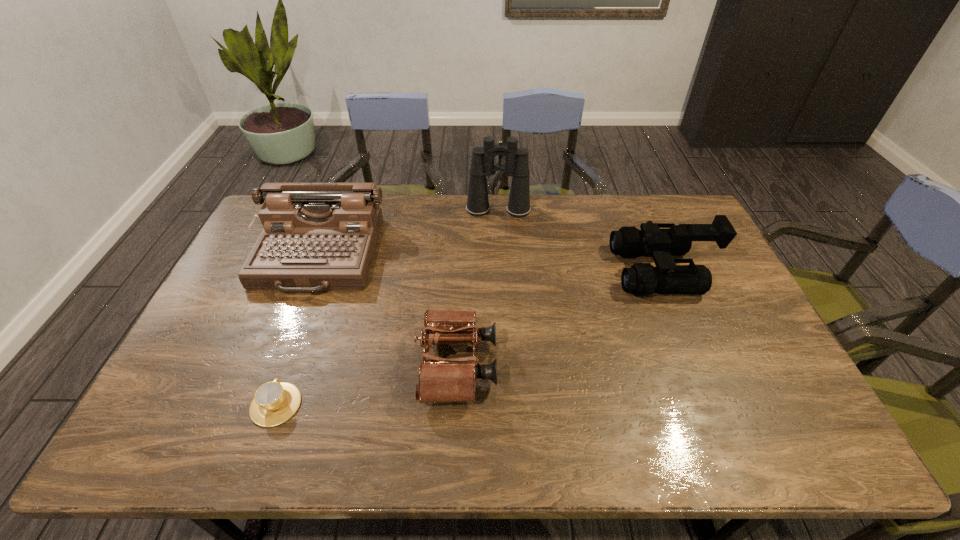
The height and width of the screenshot is (540, 960). Find the location of `object that is at the left edge`. object that is at the left edge is located at coordinates (316, 236).

I want to click on object present at the right edge, so click(642, 279).

Find the location of a particular element. This screenshot has width=960, height=540. object that is positioned at the far left corner is located at coordinates (316, 236).

This screenshot has width=960, height=540. I want to click on free region at the far edge of the desktop, so click(574, 209).

In the image, there is a desktop. Where is `free space at the near edge`? free space at the near edge is located at coordinates (469, 454).

Identify the location of free space at the right edge of the desktop. (732, 290).

In the image, there is a desktop. Where is `vacant space at the near left corner`? Image resolution: width=960 pixels, height=540 pixels. vacant space at the near left corner is located at coordinates click(156, 448).

Identify the location of vacant space at the far right corner of the desktop. Image resolution: width=960 pixels, height=540 pixels. click(x=684, y=215).

Find the location of a particular element. The height and width of the screenshot is (540, 960). vacant area at the near right corner is located at coordinates (811, 453).

Locate an element on the screen. free space that is in between the typewriter and the tallest object is located at coordinates (408, 233).